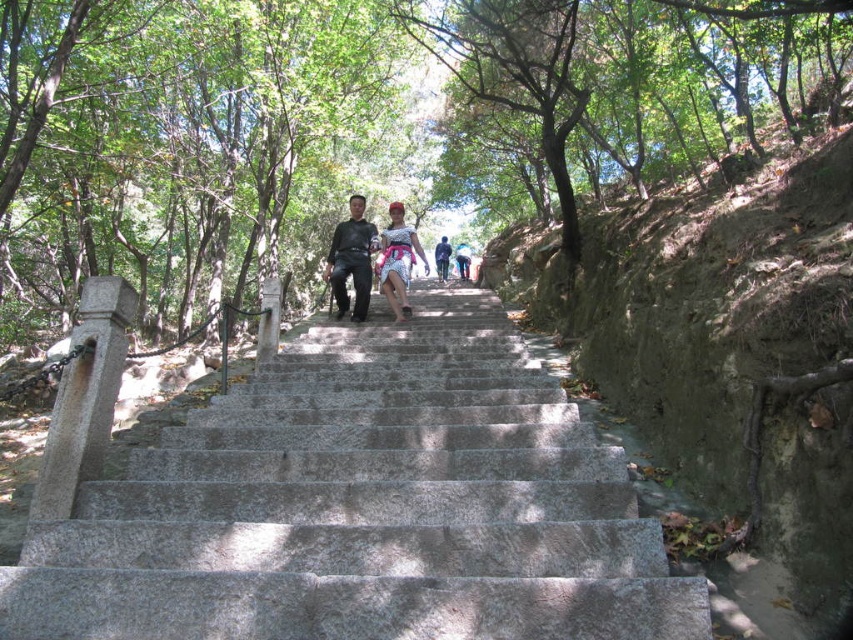
Is point (532, 572) behind point (722, 188)?

That is False.

Can you confirm if gray stone stairs at center is wider than dull gray stone stairs at center?

Yes.

Which is in front, point (317, 538) or point (596, 355)?

Point (317, 538) is more forward.

This screenshot has height=640, width=853. I want to click on gray stone stairs at center, so click(x=364, y=508).

Is gray stone stairs at center below dark gray fabric pants at center?

Yes, gray stone stairs at center is below dark gray fabric pants at center.

Measure the distance from gray stone stairs at center to dark gray fabric pants at center.

The distance of gray stone stairs at center from dark gray fabric pants at center is 6.84 meters.

What do you see at coordinates (364, 508) in the screenshot? The width and height of the screenshot is (853, 640). I see `gray stone stairs at center` at bounding box center [364, 508].

Locate an element on the screen. gray stone stairs at center is located at coordinates (364, 508).

Is dark gray fabric pants at center closer to the viewer compared to matte black dress at center?

Yes, it is.

Image resolution: width=853 pixels, height=640 pixels. What do you see at coordinates (351, 259) in the screenshot?
I see `dark gray fabric pants at center` at bounding box center [351, 259].

In order to click on dark gray fabric pants at center in this screenshot , I will do `click(351, 259)`.